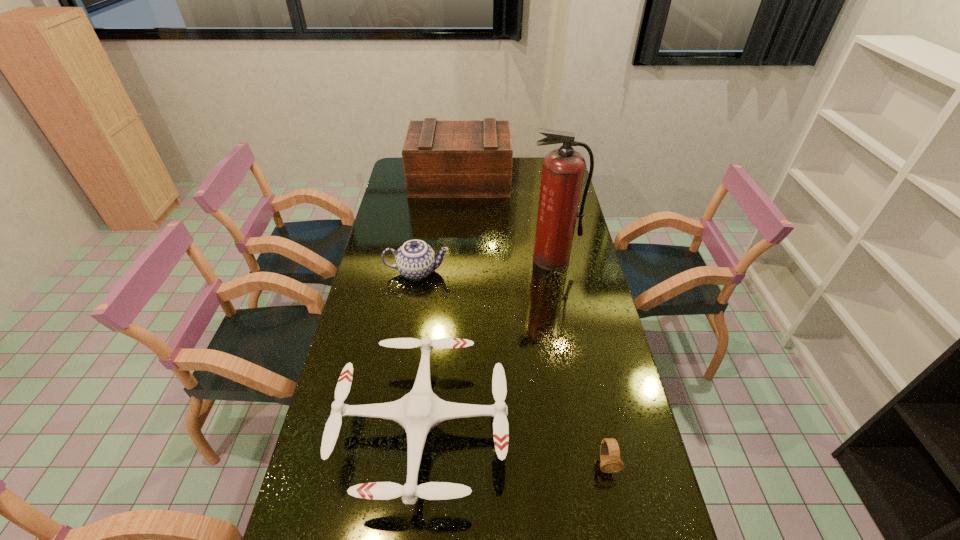
Locate an element on the screen. The image size is (960, 540). object situated at the far edge is located at coordinates (441, 158).

You are a GUI agent. You are given a task and a screenshot of the screen. Output one action in this format:
    pyautogui.click(x=<x>, y=<y>)
    Task: Click on the box that is positioned at the left edge
    Image resolution: width=960 pixels, height=540 pixels.
    Given the screenshot: What is the action you would take?
    pyautogui.click(x=441, y=158)

This screenshot has width=960, height=540. What are the coordinates of `chinaware that is at the left edge` in the screenshot? It's located at (415, 259).

Find the location of a particular element. drone that is positioned at the left edge is located at coordinates (420, 410).

Where is `fire extinguisher located at the right edge`? fire extinguisher located at the right edge is located at coordinates (563, 170).

Identify the location of watch that is at the right edge. This screenshot has width=960, height=540. [610, 460].

I want to click on object situated at the far left corner, so click(441, 158).

You are a GUI agent. You are given a task and a screenshot of the screen. Output one action in this format:
    pyautogui.click(x=<x>, y=<y>)
    Task: Click on the vacant space at the left edge of the desktop
    
    Given the screenshot: What is the action you would take?
    pyautogui.click(x=366, y=377)

In order to click on vacant region at the right edge of the desktop in this screenshot , I will do [x=612, y=415].

The width and height of the screenshot is (960, 540). I want to click on unoccupied area between the box and the chinaware, so click(x=439, y=226).